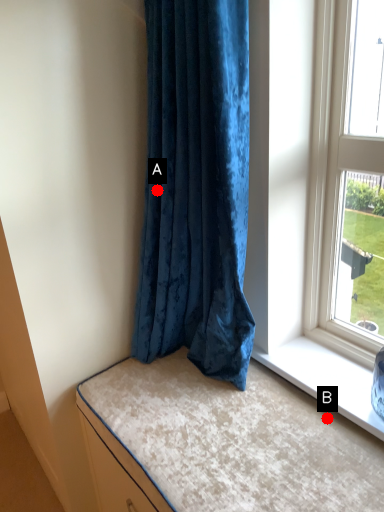
Question: Two points are circled on the image, labeled by A and B beside each circle. Which point appears closest to the camera in this image?

Choices:
 (A) A is closer
 (B) B is closer

Answer: (B)